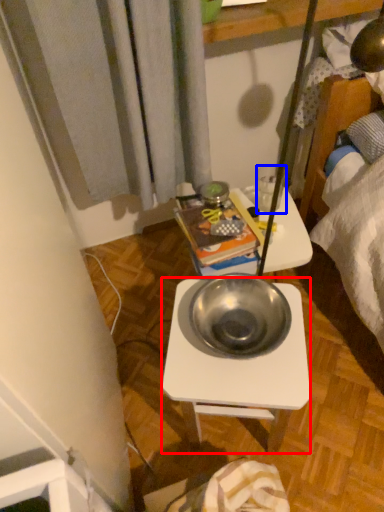
Question: Among these objects, which one is farthest to the camera, desk (highlighted by a red box) or coffee cup (highlighted by a blue box)?

Choices:
 (A) desk
 (B) coffee cup

Answer: (B)